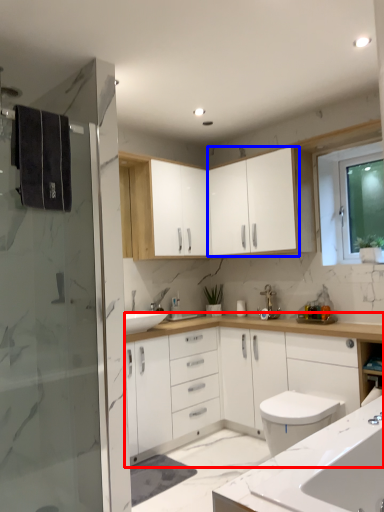
Question: Which point is further to the camera, bathroom cabinet (highlighted by a red box) or cabinetry (highlighted by a blue box)?

Choices:
 (A) bathroom cabinet
 (B) cabinetry

Answer: (B)